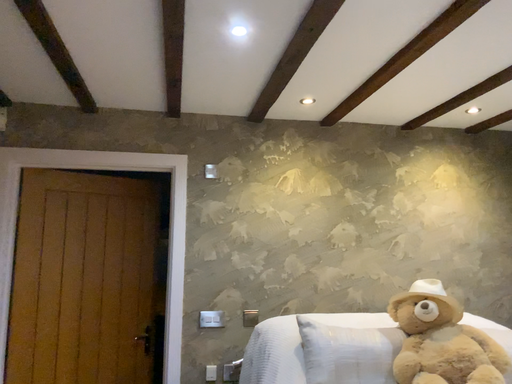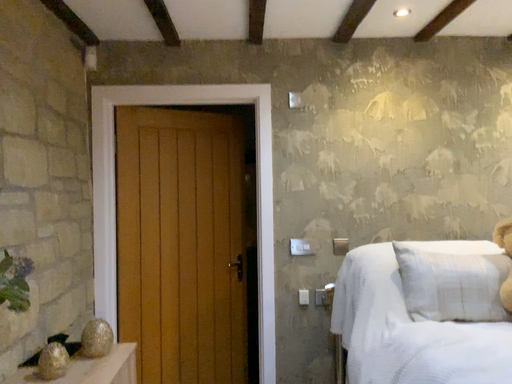
Question: Which way did the camera rotate in the video?

Choices:
 (A) rotated right
 (B) rotated left

Answer: (B)